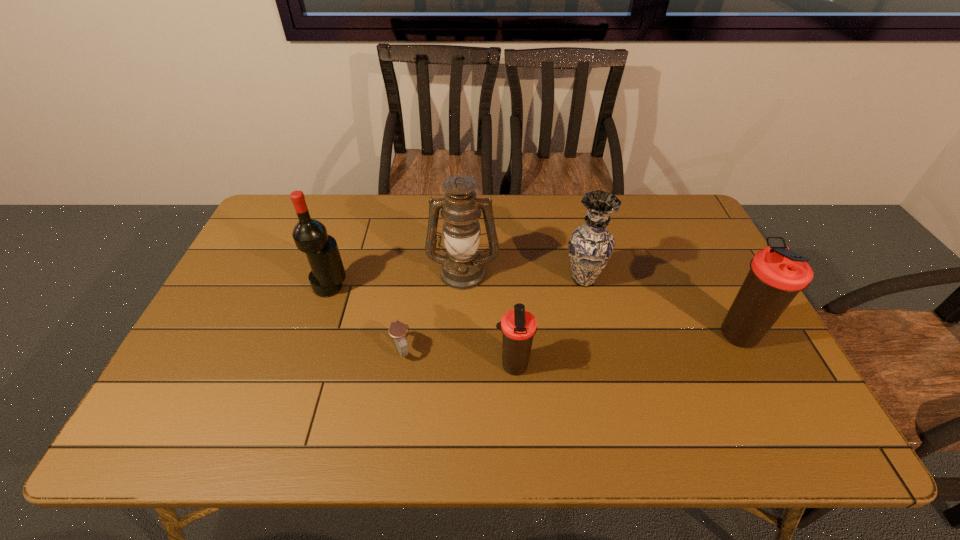
The thermos bottles are evenly distributed in the image. To maintain this, where would you place another thermos bottle on the left? Please point to a free space. Please provide its 2D coordinates. Your answer should be formatted as a tuple, i.e. [(x, y)], where the tuple contains the x and y coordinates of a point satisfying the conditions above.

[(253, 403)]